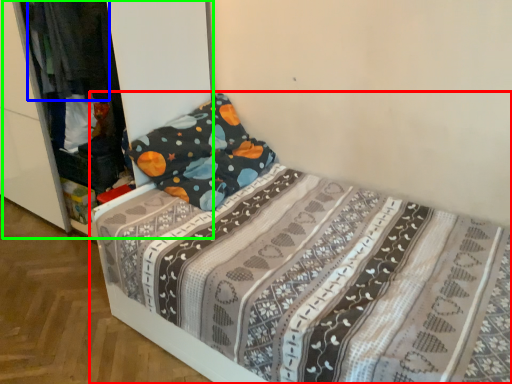
Question: Considering the real-world distances, which object is closest to bed (highlighted by a red box)? clothing (highlighted by a blue box) or dresser (highlighted by a green box).

Choices:
 (A) clothing
 (B) dresser

Answer: (A)